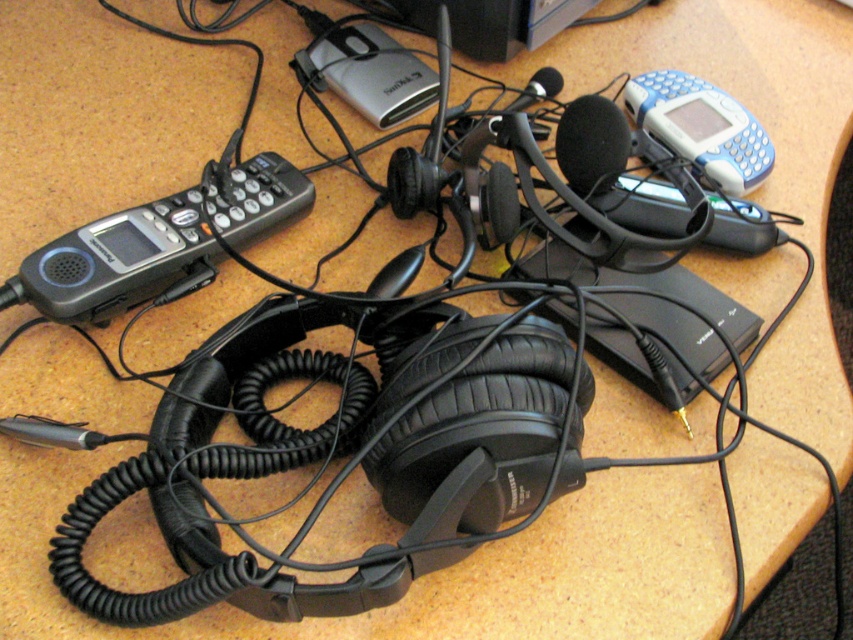
Can you confirm if black plastic phone at left is positioned below blue plastic phone at upper right?

Yes, black plastic phone at left is below blue plastic phone at upper right.

Can you confirm if black plastic phone at left is wider than blue plastic phone at upper right?

Yes, black plastic phone at left is wider than blue plastic phone at upper right.

Between point (216, 182) and point (668, 97), which one is positioned behind?

The point (668, 97) is behind.

At what (x,y) coordinates should I click in order to perform the action: click on black plastic phone at left. Please return your answer as a coordinate pair (x, y). Looking at the image, I should click on (157, 243).

Can you confirm if black plastic phone at left is bigger than black foam microphone at upper center?

Indeed, black plastic phone at left has a larger size compared to black foam microphone at upper center.

Which is behind, point (251, 241) or point (575, 152)?

The point (251, 241) is more distant.

The height and width of the screenshot is (640, 853). What are the coordinates of `black plastic phone at left` in the screenshot? It's located at (157, 243).

Between point (688, 152) and point (619, 134), which one is positioned behind?

The point (688, 152) is behind.

Between point (668, 104) and point (567, 156), which one is positioned behind?

Positioned behind is point (668, 104).

You are a GUI agent. You are given a task and a screenshot of the screen. Output one action in this format:
    pyautogui.click(x=<x>, y=<y>)
    Task: Click on the blue plastic phone at upper right
    The image size is (853, 640).
    Given the screenshot: What is the action you would take?
    pyautogui.click(x=701, y=128)